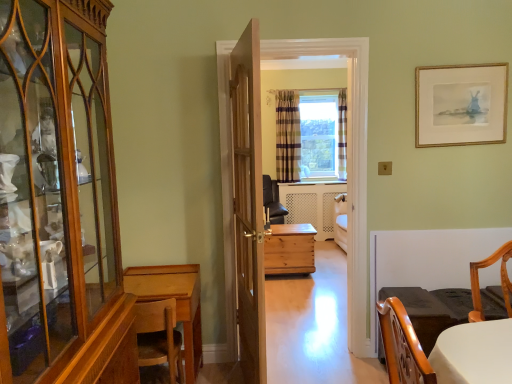
Question: Do you think plaid fabric curtain at center, positioned as the second curtain in right-to-left order, is within white glossy table at lower right, or outside of it?

Choices:
 (A) outside
 (B) inside

Answer: (A)

Question: Considering the positions of point [x=278, y=144] and point [x=453, y=296], is point [x=278, y=144] closer or farther from the camera than point [x=453, y=296]?

Choices:
 (A) closer
 (B) farther

Answer: (B)

Question: Which object is positioned farthest from the plaid fabric curtain at center, placed as the 1th curtain when sorted from right to left?

Choices:
 (A) natural wood chest at center, which appears as the 2th desk when viewed from the front
 (B) wooden cabinet at left
 (C) white glossy table at lower right
 (D) wooden picture frame at upper right
 (E) wooden door at center

Answer: (B)

Question: Which is nearer to the plaid fabric curtain at center, which is counted as the 2th curtain, starting from the left?

Choices:
 (A) wooden desk at lower left, the 1th desk from the left
 (B) wooden chair at lower left
 (C) plaid fabric curtain at center, the first curtain viewed from the left
 (D) wooden chest at center
 (E) natural wood chest at center, which appears as the 2th desk when viewed from the front

Answer: (C)